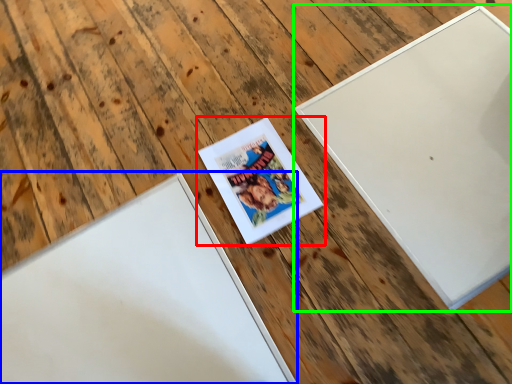
Question: Based on their relative distances, which object is nearer to picture frame (highlighted by a red box)? Choose from picture frame (highlighted by a blue box) and picture frame (highlighted by a green box).

Choices:
 (A) picture frame
 (B) picture frame

Answer: (A)